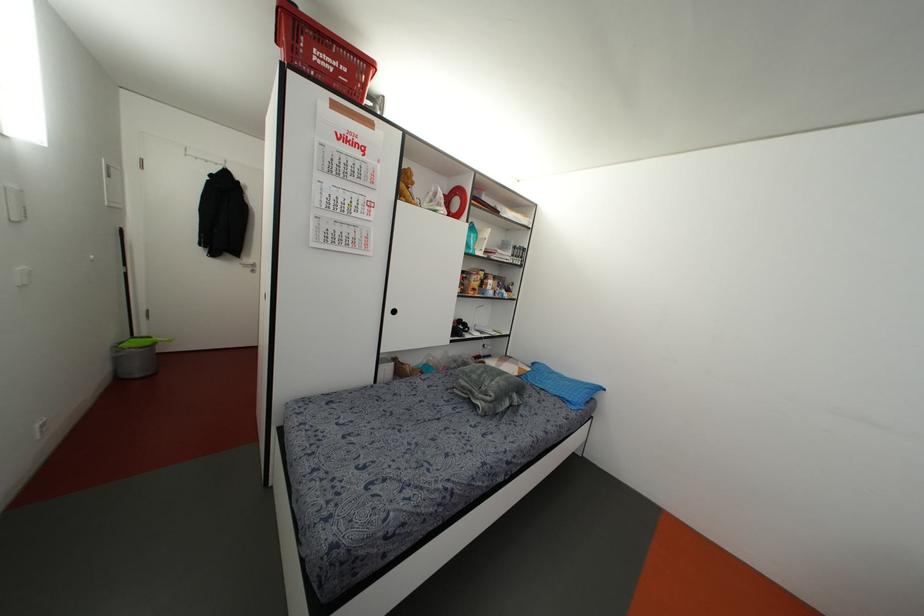
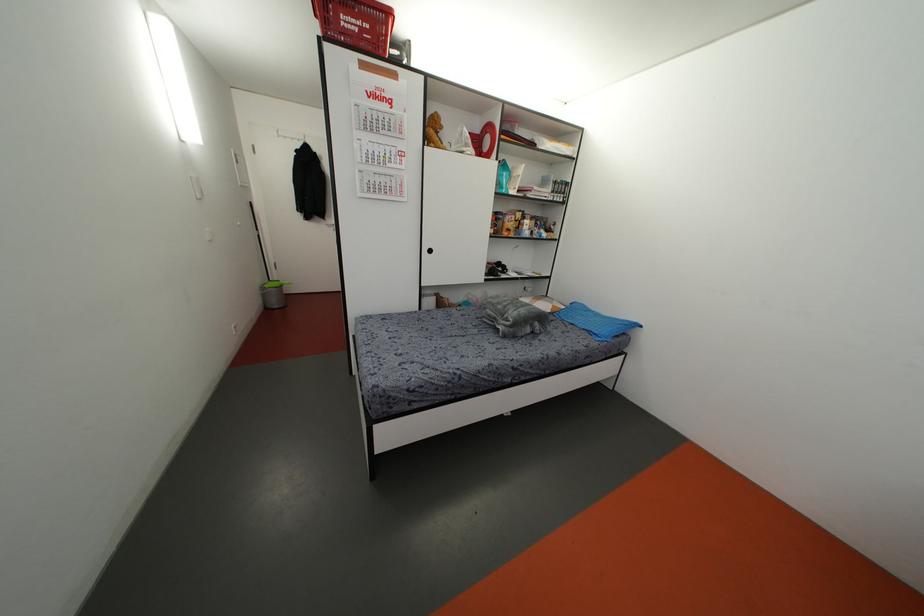
Locate, in the second image, the point that corresponds to (x=569, y=399) in the first image.

(596, 331)